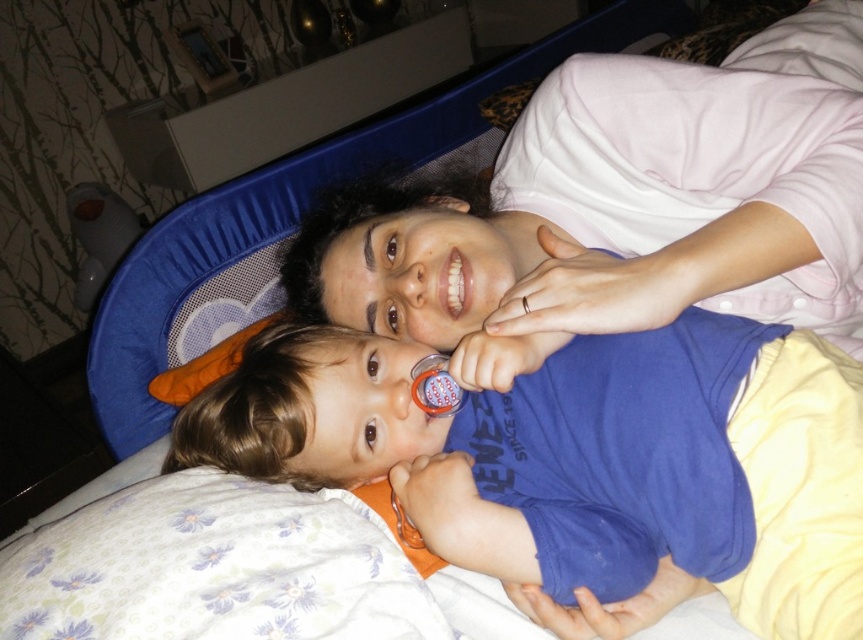
You are a photographer trying to capture the perfect shot of the scene. The pink soft shirt at upper center is located at point (x=616, y=209). Where should you position your camera to ensure the pink soft shirt at upper center is centered in your frame?

To center the pink soft shirt at upper center in your frame, position your camera directly facing the point (x=616, y=209) where the pink soft shirt at upper center is located.

Based on the scene description, can you determine which object is wider between the white glossy teeth at center and the rubber teething ring at mouth?

The white glossy teeth at center is wider than the rubber teething ring at mouth according to the description.